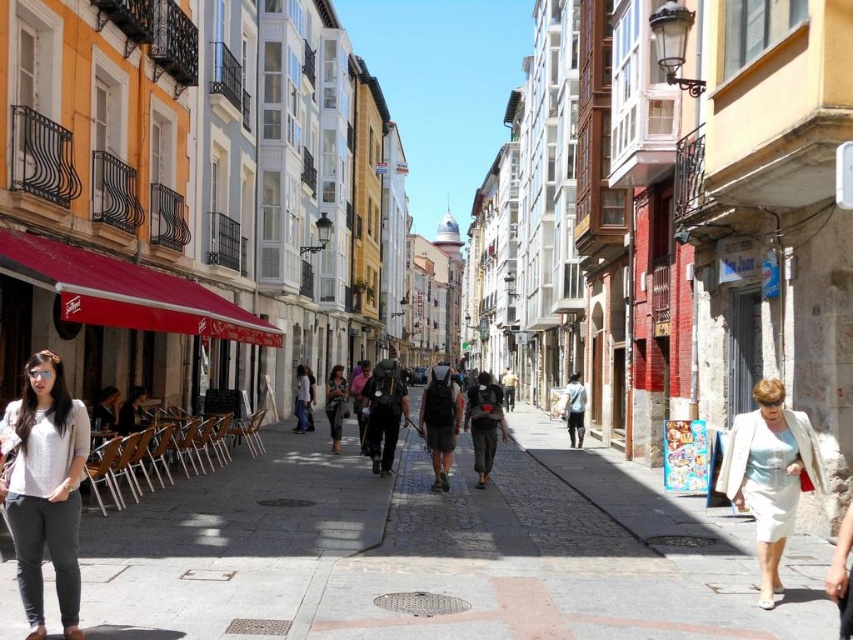
Question: Which object is farther from the camera taking this photo?

Choices:
 (A) light gray cotton pants at lower left
 (B) white satin skirt at lower right
 (C) dark gray backpack at center

Answer: (C)

Question: From the image, what is the correct spatial relationship of white satin skirt at lower right in relation to dark gray backpack at center?

Choices:
 (A) above
 (B) below

Answer: (A)

Question: Among these objects, which one is nearest to the camera?

Choices:
 (A) white satin skirt at lower right
 (B) smooth concrete sidewalk at center
 (C) dark gray backpack at center

Answer: (B)

Question: Is white satin skirt at lower right closer to the viewer compared to dark gray backpack at center?

Choices:
 (A) yes
 (B) no

Answer: (A)

Question: Which point is farther from the camera taking this photo?

Choices:
 (A) (184, 628)
 (B) (772, 496)
 (C) (39, 454)

Answer: (B)

Question: Can you confirm if smooth concrete sidewalk at center is bigger than dark gray backpack at center?

Choices:
 (A) no
 (B) yes

Answer: (B)